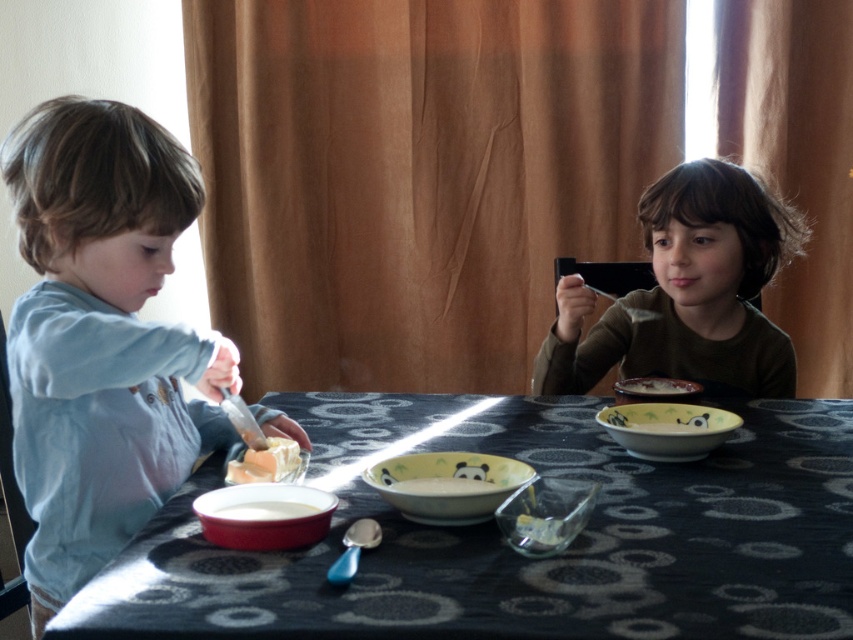
Question: Does matte ceramic bowl at lower left appear on the left side of yellow ceramic bowl at center?

Choices:
 (A) yes
 (B) no

Answer: (A)

Question: Does matte plastic table at center appear over smooth blue shirt at left?

Choices:
 (A) yes
 (B) no

Answer: (B)

Question: Which of the following is the farthest from the observer?

Choices:
 (A) 213,515
 (B) 242,464

Answer: (B)

Question: Which point is farther to the camera?

Choices:
 (A) (239, 518)
 (B) (276, 506)

Answer: (B)

Question: Considering the real-world distances, which object is closest to the white creamy soup at lower left?

Choices:
 (A) matte yellow bowl at center
 (B) smooth orange cheese at center
 (C) matte plastic table at center
 (D) matte green bowl at center

Answer: (B)

Question: Does matte ceramic bowl at lower left have a lesser width compared to white matte bowl at center?

Choices:
 (A) no
 (B) yes

Answer: (A)